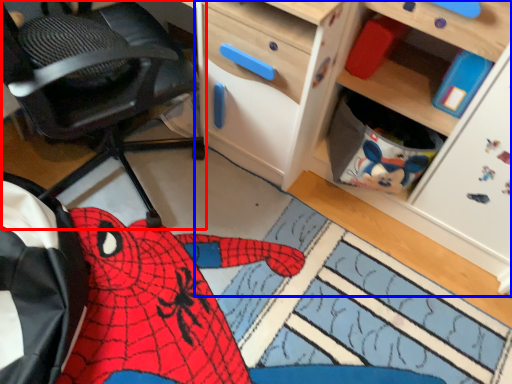
Question: Which point is further to the camera, chair (highlighted by a red box) or cabinetry (highlighted by a blue box)?

Choices:
 (A) chair
 (B) cabinetry

Answer: (B)